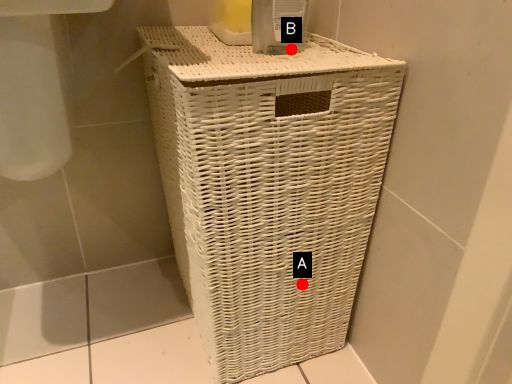
Question: Two points are circled on the image, labeled by A and B beside each circle. Which point is farther to the camera?

Choices:
 (A) A is further
 (B) B is further

Answer: (A)